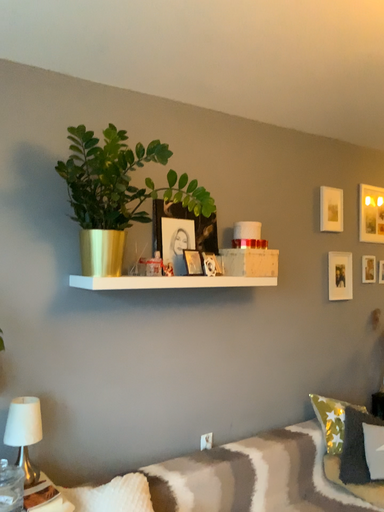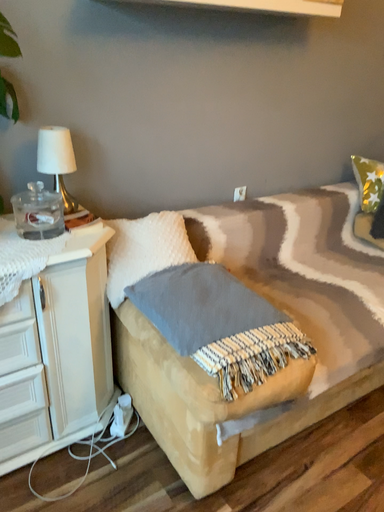
Question: Which way did the camera rotate in the video?

Choices:
 (A) rotated upward
 (B) rotated downward

Answer: (B)